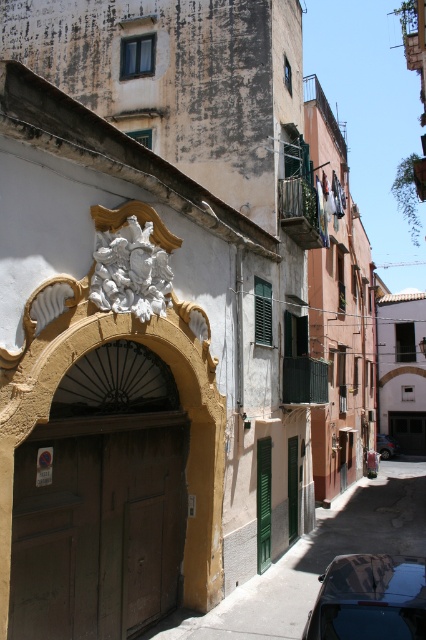
You are standing on the street and want to reach the point at coordinates point [416,632]. If your walking speed is 1.5 meters per second, how many seconds will it take you to reach the point?

The distance between you and point [416,632] is 5.07 meters. At a speed of 1.5 meters per second, dividing the distance by speed gives approximately 3.38 seconds. So, it will take about 3.38 seconds to reach the point.

You are a delivery person needing to park your 15 feet long truck between the shiny black car at lower right and the metallic silver car at center. Based on the scene, can you fit your truck in that space?

The distance between the shiny black car at lower right and the metallic silver car at center is 103.14 feet. Since your truck is only 15 feet long, there is ample space to park it between them.

You are a delivery person trying to park your van in this narrow street. You see a shiny black car at lower right and a metallic silver car at center. Which car is closer to the left side of the street?

The shiny black car at lower right is positioned on the left side of the metallic silver car at center, so it is closer to the left side of the street.